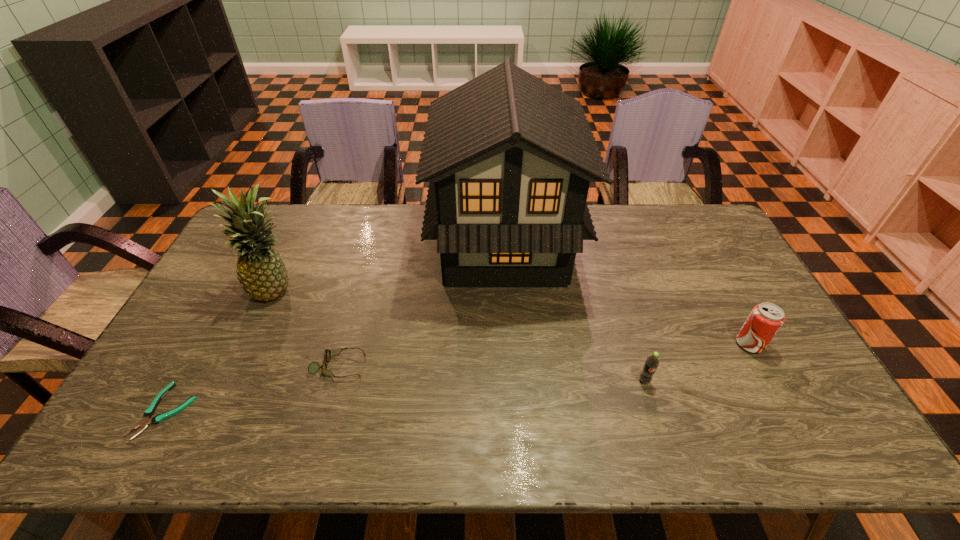
You are a GUI agent. You are given a task and a screenshot of the screen. Output one action in this format:
    pyautogui.click(x=<x>, y=<y>)
    Task: Click on the vacant area situated on the front-facing side of the dollhouse
    The image size is (960, 540).
    Given the screenshot: What is the action you would take?
    pyautogui.click(x=378, y=246)

The height and width of the screenshot is (540, 960). What are the coordinates of `free spot located on the front-facing side of the dollhouse` in the screenshot? It's located at (352, 246).

Locate an element on the screen. vacant space situated 0.390m on the front-facing side of the dollhouse is located at coordinates (318, 246).

Locate an element on the screen. The height and width of the screenshot is (540, 960). free point located on the front of the second tallest object is located at coordinates (235, 382).

Where is `free point located 0.150m on the front of the third tallest object`? free point located 0.150m on the front of the third tallest object is located at coordinates (782, 404).

Identify the location of vacant space located on the front label of the shorter soda. The image size is (960, 540). (660, 434).

At what (x,y) coordinates should I click in order to perform the action: click on vacant area situated on the front-facing side of the fifth tallest object. Please return your answer as a coordinate pair (x, y). This screenshot has height=540, width=960. Looking at the image, I should click on (488, 366).

Find the location of a particular element. The image size is (960, 540). free region located on the back of the shortest object is located at coordinates (238, 282).

You are a GUI agent. You are given a task and a screenshot of the screen. Output one action in this format:
    pyautogui.click(x=<x>, y=<y>)
    Task: Click on the object that is at the far edge
    The height and width of the screenshot is (540, 960).
    Given the screenshot: What is the action you would take?
    pyautogui.click(x=509, y=158)

Where is `object that is positioned at the near edge`? object that is positioned at the near edge is located at coordinates (149, 412).